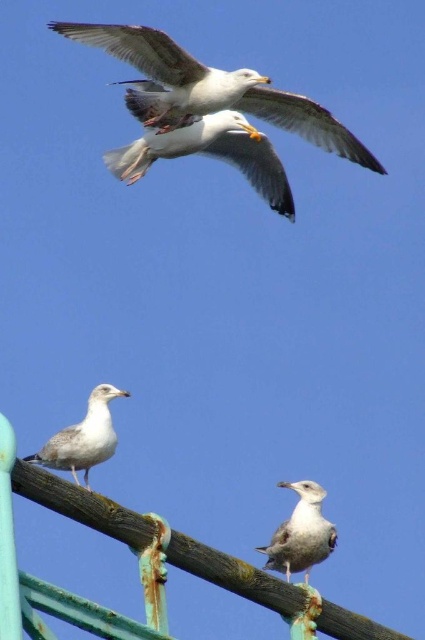
Question: Considering the relative positions of white feathered seagull at upper center and white feathered seagull at center in the image provided, where is white feathered seagull at upper center located with respect to white feathered seagull at center?

Choices:
 (A) right
 (B) left

Answer: (B)

Question: Does white feathered seagull at upper center come behind light gray feathered seagull at center?

Choices:
 (A) yes
 (B) no

Answer: (A)

Question: Which object is positioned farthest from the light gray feathered seagull at center?

Choices:
 (A) white feathered seagull at upper center
 (B) white feathered seagull at center

Answer: (A)

Question: Which is farther from the white feathered seagull at center?

Choices:
 (A) white feathered seagull at upper center
 (B) light gray feathered seagull at center

Answer: (A)

Question: Among these objects, which one is farthest from the camera?

Choices:
 (A) light gray feathered seagull at center
 (B) white feathered seagull at center
 (C) white feathered seagull at upper center

Answer: (C)

Question: In this image, where is white feathered seagull at upper center located relative to white feathered seagull at center?

Choices:
 (A) left
 (B) right

Answer: (A)